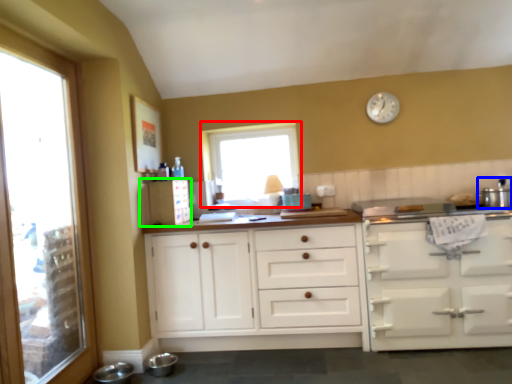
Question: Based on their relative distances, which object is farther from window (highlighted by a red box)? Choose from appliance (highlighted by a blue box) and appliance (highlighted by a green box).

Choices:
 (A) appliance
 (B) appliance

Answer: (A)